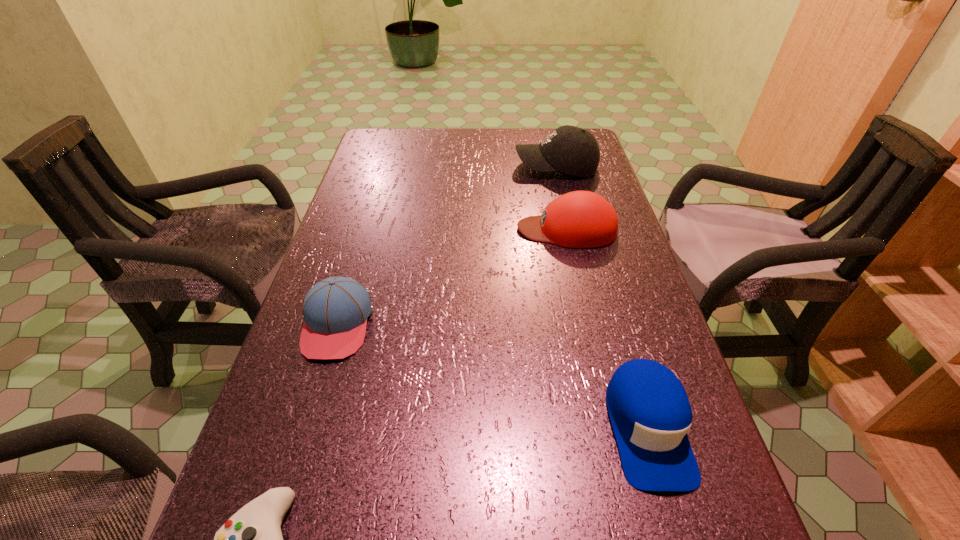
Identify the location of free spot located 0.180m on the front-facing side of the third nearest baseball cap. This screenshot has width=960, height=540. (449, 229).

At what (x,y) coordinates should I click in order to perform the action: click on vacant space located on the front-facing side of the third nearest baseball cap. Please return your answer as a coordinate pair (x, y). The image size is (960, 540). Looking at the image, I should click on (442, 229).

The height and width of the screenshot is (540, 960). Identify the location of vacant space located 0.100m on the front-facing side of the leftmost baseball cap. (312, 409).

The height and width of the screenshot is (540, 960). In order to click on object that is positioned at the far edge in this screenshot , I will do (569, 149).

Where is `object that is at the left edge`? object that is at the left edge is located at coordinates (335, 310).

I want to click on object present at the far right corner, so click(569, 149).

Identify the location of free spot at the far edge of the desktop. (432, 137).

In the image, there is a desktop. What are the coordinates of `vacant space at the left edge` in the screenshot? It's located at (311, 410).

At what (x,y) coordinates should I click in order to perform the action: click on vacant space at the right edge of the desktop. Please return your answer as a coordinate pair (x, y). Image resolution: width=960 pixels, height=540 pixels. Looking at the image, I should click on (609, 341).

Locate an element on the screen. Image resolution: width=960 pixels, height=540 pixels. vacant region between the second farthest object and the nearest baseball cap is located at coordinates (607, 328).